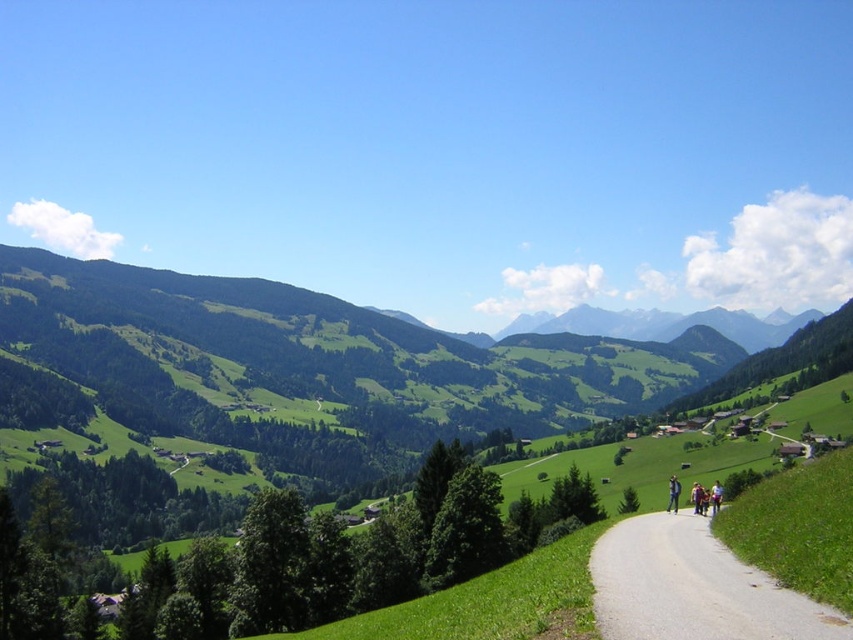
You are planning a hiking trip and want to know the exact location of the gray gravel road at center in the image. Could you provide its coordinates?

The gray gravel road at center is located at coordinates point (694, 588).